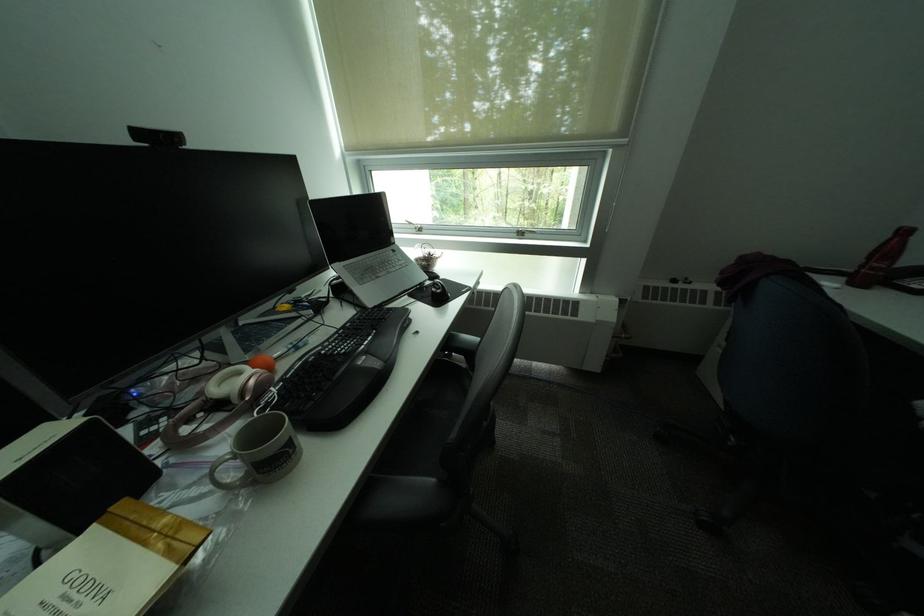
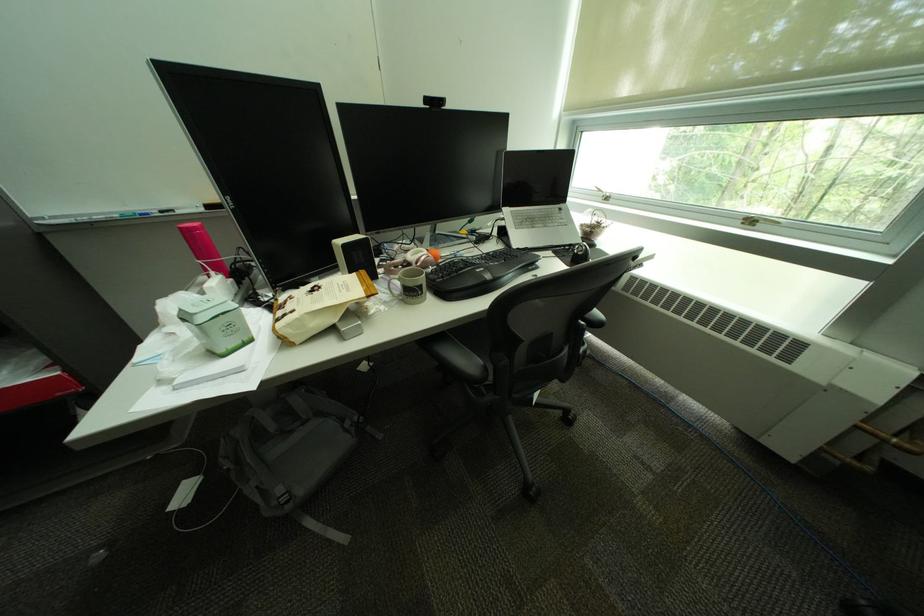
Question: I am providing you with two images of the same scene from different viewpoints. After the viewpoint changes to image2, which objects are now occluded?

Choices:
 (A) chair armrest
 (B) window handle
 (C) pink thermos
 (D) none of these

Answer: (D)